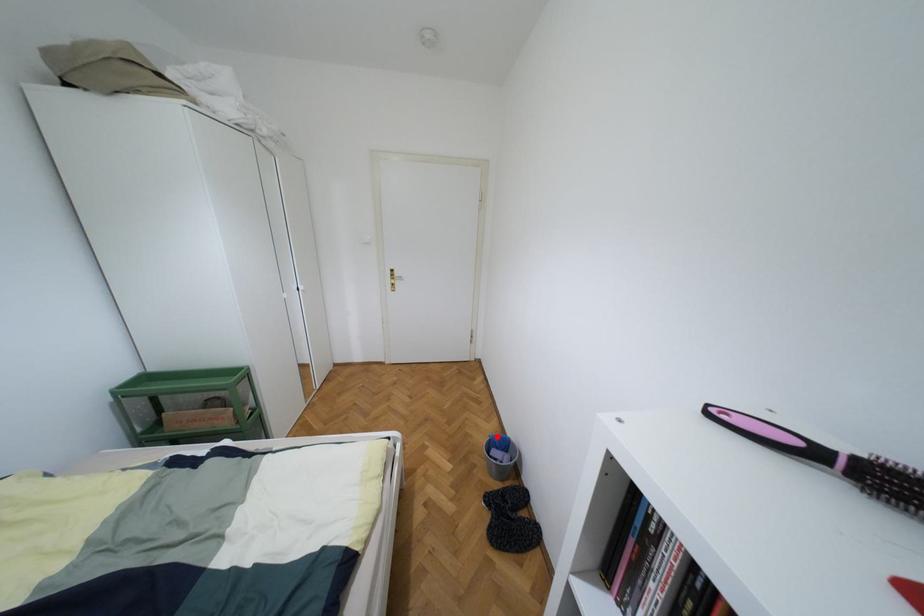
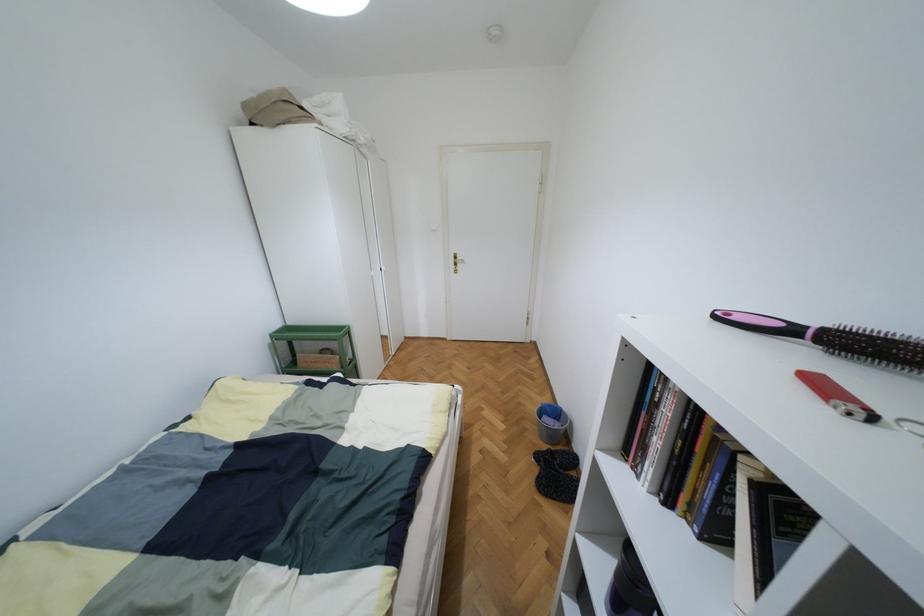
In the second image, find the point that corresponds to the highlighted location in the first image.

(549, 406)